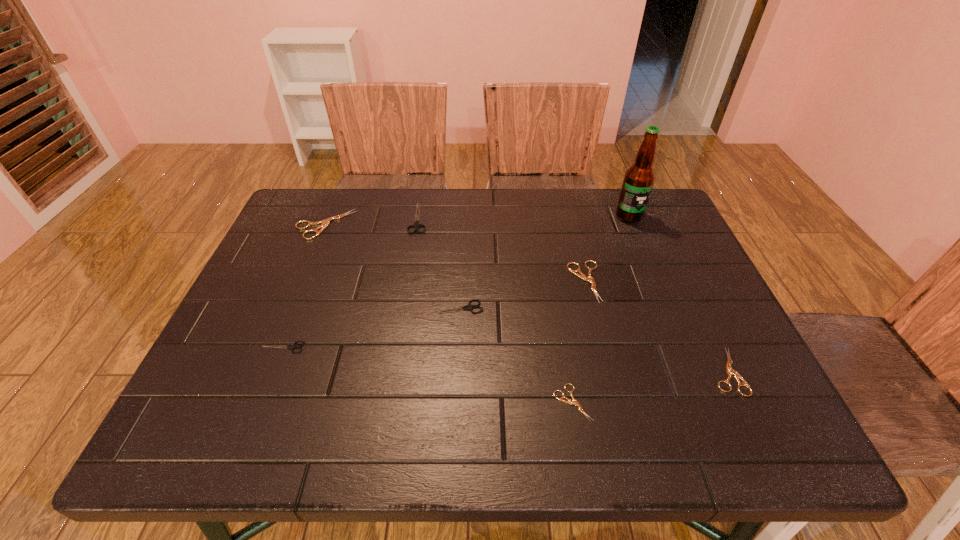
The width and height of the screenshot is (960, 540). Identify the location of free space at the far edge of the desktop. (602, 217).

Image resolution: width=960 pixels, height=540 pixels. I want to click on free space at the near edge of the desktop, so click(x=519, y=410).

Locate an element on the screen. Image resolution: width=960 pixels, height=540 pixels. vacant point at the left edge is located at coordinates (312, 252).

Where is `free space at the right edge`? Image resolution: width=960 pixels, height=540 pixels. free space at the right edge is located at coordinates (x=672, y=332).

Where is `free space at the far left corner`? The image size is (960, 540). free space at the far left corner is located at coordinates (314, 192).

Find the location of a particular element. vacant space at the far right corner is located at coordinates (653, 199).

What are the coordinates of `vacant space at the near right corner of the desktop` in the screenshot? It's located at (764, 449).

Locate an element on the screen. This screenshot has width=960, height=540. free space between the sixth object from left to right and the beer bottle is located at coordinates (607, 249).

Where is `empty space between the beer bottle and the farthest beige shears`? empty space between the beer bottle and the farthest beige shears is located at coordinates (477, 220).

Locate an element on the screen. This screenshot has height=540, width=960. vacant region between the rightmost black shears and the smallest black shears is located at coordinates (370, 328).